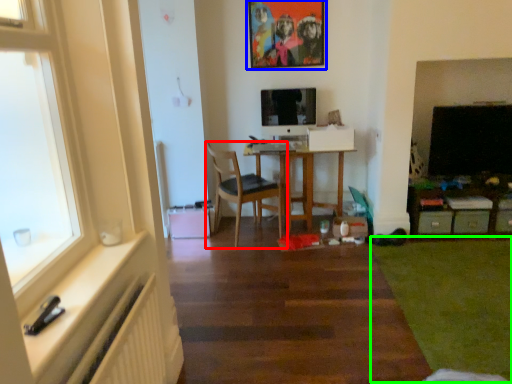
Question: Based on their relative distances, which object is nearer to chair (highlighted by a red box)? Choose from picture frame (highlighted by a blue box) and plain (highlighted by a green box).

Choices:
 (A) picture frame
 (B) plain

Answer: (A)